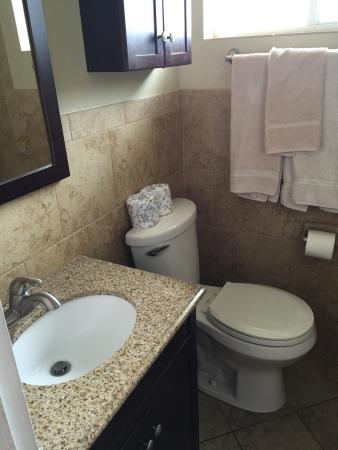
Where is `water closet`? This screenshot has width=338, height=450. water closet is located at coordinates (180, 255).